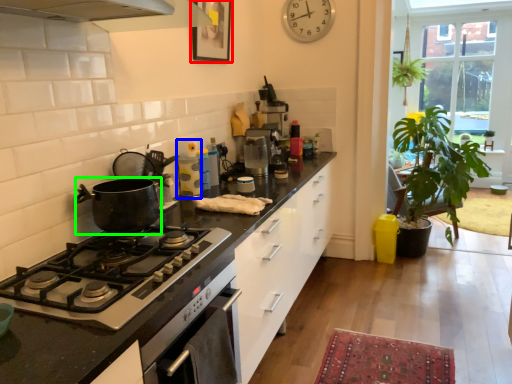
Question: Based on their relative distances, which object is nearer to picture frame (highlighted by a red box)? Choose from appliance (highlighted by a blue box) and kitchen appliance (highlighted by a green box).

Choices:
 (A) appliance
 (B) kitchen appliance

Answer: (A)